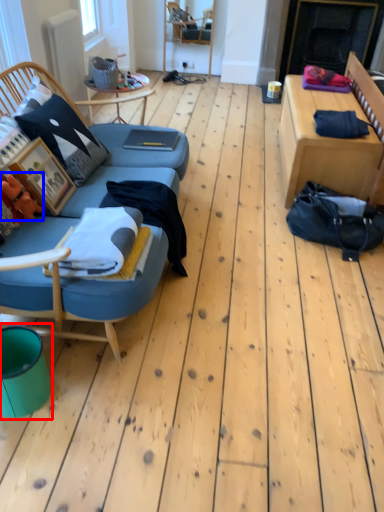
Question: Among these objects, which one is farthest to the camera, teal (highlighted by a red box) or toy (highlighted by a blue box)?

Choices:
 (A) teal
 (B) toy

Answer: (B)